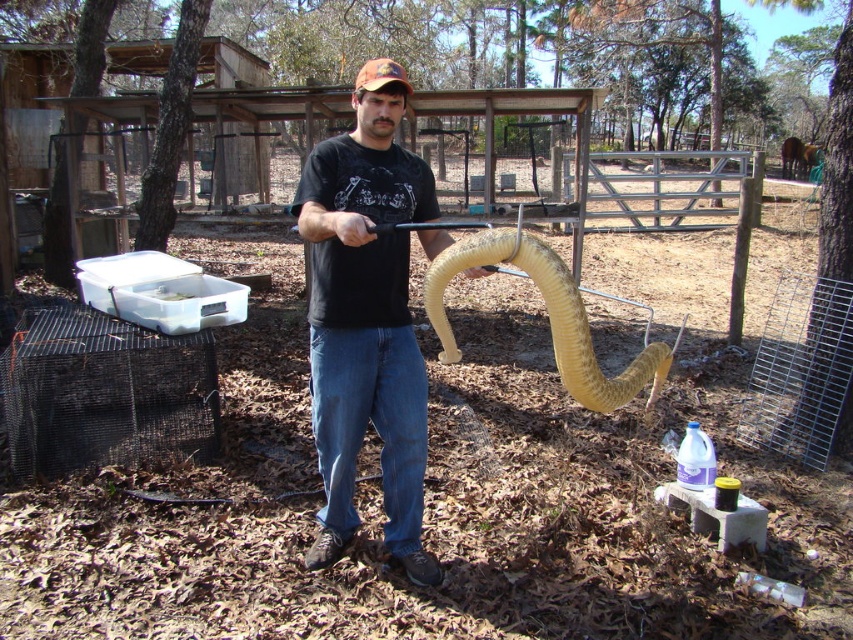
Who is taller, yellow rubber snake at center or orange fabric baseball cap at center?

Standing taller between the two is orange fabric baseball cap at center.

Who is lower down, yellow rubber snake at center or orange fabric baseball cap at center?

yellow rubber snake at center is lower down.

Between point (577, 387) and point (392, 76), which one is positioned behind?

Positioned behind is point (392, 76).

At what (x,y) coordinates should I click in order to perform the action: click on yellow rubber snake at center. Please return your answer as a coordinate pair (x, y). The height and width of the screenshot is (640, 853). Looking at the image, I should click on (548, 317).

The image size is (853, 640). What are the coordinates of `black matte shirt at center` in the screenshot? It's located at (366, 324).

Is black matte shirt at center wider than orange fabric baseball cap at center?

No.

Is point (415, 205) less distant than point (380, 68)?

No.

Locate an element on the screen. The height and width of the screenshot is (640, 853). black matte shirt at center is located at coordinates (366, 324).

This screenshot has height=640, width=853. What do you see at coordinates (366, 324) in the screenshot?
I see `black matte shirt at center` at bounding box center [366, 324].

Is black matte shirt at center taller than yellow rubber snake at center?

Yes, black matte shirt at center is taller than yellow rubber snake at center.

What do you see at coordinates (366, 324) in the screenshot? The height and width of the screenshot is (640, 853). I see `black matte shirt at center` at bounding box center [366, 324].

Image resolution: width=853 pixels, height=640 pixels. In order to click on black matte shirt at center in this screenshot , I will do `click(366, 324)`.